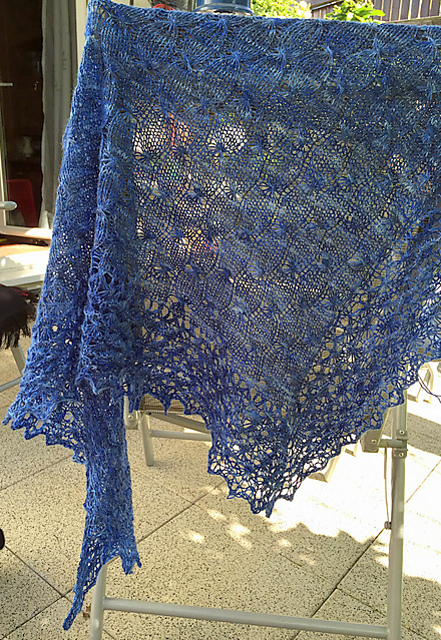
Identify the location of tile. The image size is (441, 640). (183, 447).